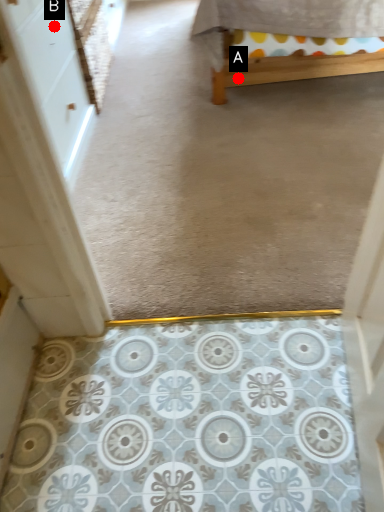
Question: Two points are circled on the image, labeled by A and B beside each circle. Which point is farther from the camera taking this photo?

Choices:
 (A) A is further
 (B) B is further

Answer: (A)